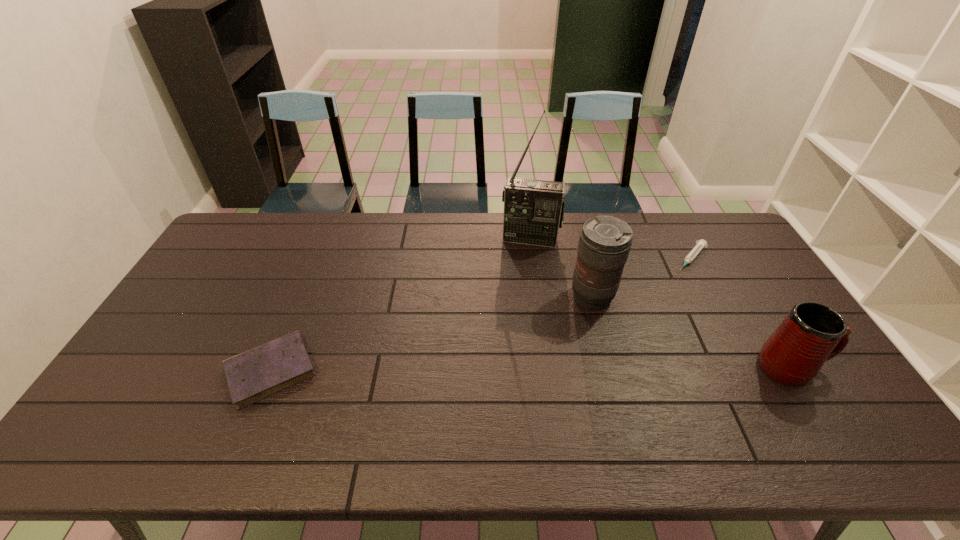
Identify the location of free spot between the syringe and the telephoto lens. (641, 278).

You are a GUI agent. You are given a task and a screenshot of the screen. Output one action in this format:
    pyautogui.click(x=<x>, y=<y>)
    Task: Click on the empty location between the second tallest object and the syringe
    The width and height of the screenshot is (960, 540).
    Given the screenshot: What is the action you would take?
    pyautogui.click(x=641, y=278)

Find the location of a particular element. The image size is (960, 540). free space between the telephoto lens and the third tallest object is located at coordinates (692, 332).

You are a GUI agent. You are given a task and a screenshot of the screen. Output one action in this format:
    pyautogui.click(x=<x>, y=<y>)
    Task: Click on the free space that is in between the third shortest object and the second tallest object
    This screenshot has width=960, height=540.
    Given the screenshot: What is the action you would take?
    pyautogui.click(x=692, y=332)

The height and width of the screenshot is (540, 960). What are the coordinates of `free space between the third farthest object and the third shortest object` in the screenshot? It's located at (692, 332).

Locate an element on the screen. empty space that is in between the leftmost object and the second tallest object is located at coordinates coord(431,334).

Identify the location of empty space that is in between the leftmost object and the tallest object. (401, 305).

I want to click on empty location between the fourth shortest object and the leftmost object, so click(431, 334).

What are the coordinates of `free spot between the radio receiver and the telephoto lens` in the screenshot? It's located at (562, 268).

What are the coordinates of `object that is the third closest one to the telephoto lens` in the screenshot? It's located at (812, 333).